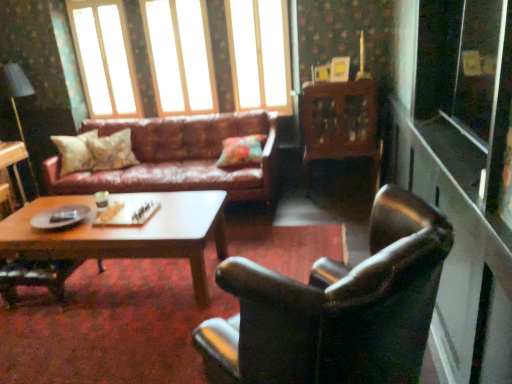
Question: Does leather couch at center have a smaller size compared to leather armchair at right?

Choices:
 (A) no
 (B) yes

Answer: (A)

Question: Considering the relative sizes of leather couch at center and leather armchair at right in the image provided, is leather couch at center wider than leather armchair at right?

Choices:
 (A) no
 (B) yes

Answer: (B)

Question: From the image's perspective, is leather couch at center located above leather armchair at right?

Choices:
 (A) yes
 (B) no

Answer: (A)

Question: Does leather couch at center turn towards leather armchair at right?

Choices:
 (A) no
 (B) yes

Answer: (B)

Question: Considering the relative positions of leather couch at center and leather armchair at right in the image provided, is leather couch at center to the right of leather armchair at right from the viewer's perspective?

Choices:
 (A) yes
 (B) no

Answer: (B)

Question: Considering the relative positions of leather couch at center and leather armchair at right in the image provided, is leather couch at center in front of leather armchair at right?

Choices:
 (A) yes
 (B) no

Answer: (B)

Question: Is clear glass window at upper center, which appears as the 3th window when viewed from the right, oriented away from fluffy beige pillow at center, the first pillow positioned from the left?

Choices:
 (A) yes
 (B) no

Answer: (B)

Question: Is the position of clear glass window at upper center, which appears as the 3th window when viewed from the right, more distant than that of fluffy beige pillow at center, the first pillow positioned from the left?

Choices:
 (A) yes
 (B) no

Answer: (A)

Question: Is clear glass window at upper center, which appears as the 3th window when viewed from the right, closer to camera compared to fluffy beige pillow at center, positioned as the 3th pillow in right-to-left order?

Choices:
 (A) yes
 (B) no

Answer: (B)

Question: Can you confirm if clear glass window at upper center, the first window positioned from the left, is shorter than fluffy beige pillow at center, the first pillow positioned from the left?

Choices:
 (A) yes
 (B) no

Answer: (B)

Question: Does clear glass window at upper center, which appears as the 3th window when viewed from the right, have a greater width compared to fluffy beige pillow at center, the first pillow positioned from the left?

Choices:
 (A) no
 (B) yes

Answer: (A)

Question: From a real-world perspective, is clear glass window at upper center, which appears as the 3th window when viewed from the right, on top of fluffy beige pillow at center, the first pillow positioned from the left?

Choices:
 (A) no
 (B) yes

Answer: (B)

Question: Does matte black lampshade at upper left lie behind transparent glass screen door at right?

Choices:
 (A) yes
 (B) no

Answer: (A)